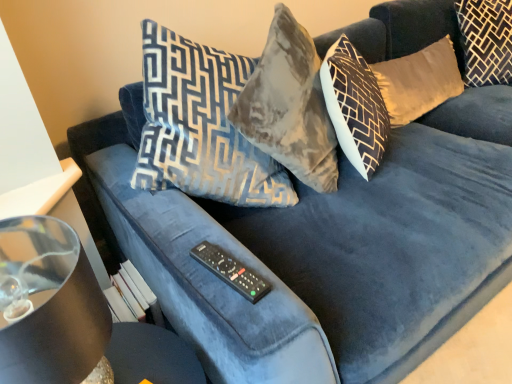
Question: From a real-world perspective, is velvet gold pillow at upper right, the second pillow positioned from the left, above or below transparent glass table at lower left?

Choices:
 (A) below
 (B) above

Answer: (B)

Question: Looking at their shapes, would you say velvet gold pillow at upper right, the 1th pillow from the right, is wider or thinner than transparent glass table at lower left?

Choices:
 (A) wide
 (B) thin

Answer: (A)

Question: Estimate the real-world distances between objects in this image. Which object is farther from the shiny black lampshade at left?

Choices:
 (A) transparent glass table at lower left
 (B) velvet gold pillow at upper right, the 1th pillow from the left
 (C) velvet gold pillow at upper right, the second pillow positioned from the left
 (D) black plastic remote at center

Answer: (C)

Question: Based on their relative distances, which object is nearer to the velvet gold pillow at upper right, the 1th pillow from the right?

Choices:
 (A) shiny black lampshade at left
 (B) black plastic remote at center
 (C) transparent glass table at lower left
 (D) velvet gold pillow at upper right, placed as the 2th pillow when sorted from right to left

Answer: (D)